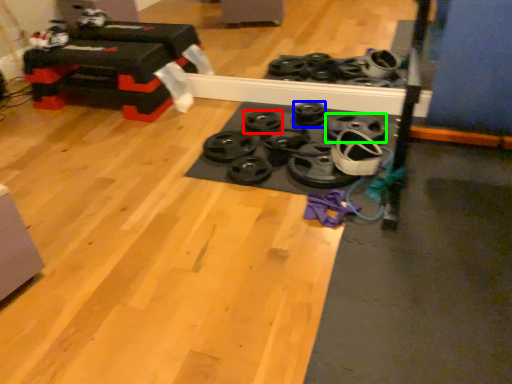
Question: Which is nearer to the wheel (highlighted by a red box)? wheel (highlighted by a blue box) or wheel (highlighted by a green box).

Choices:
 (A) wheel
 (B) wheel

Answer: (A)